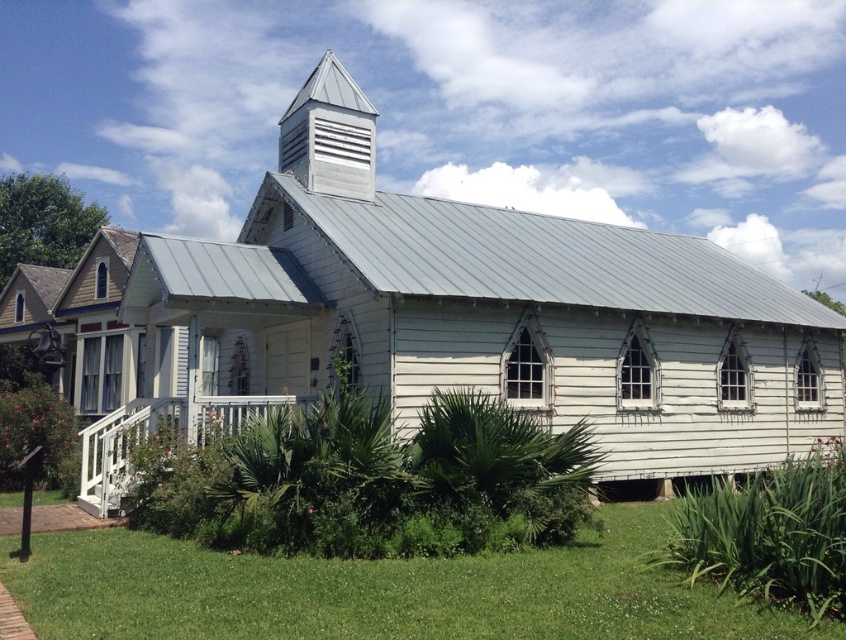
Measure the distance between point (x=146, y=540) and camera.

Point (x=146, y=540) and camera are 10.81 meters apart.

At what (x,y) coordinates should I click in order to perform the action: click on green grass at lower center. Please return your answer as a coordinate pair (x, y). Looking at the image, I should click on (377, 592).

Locate an element on the screen. This screenshot has height=640, width=846. green grass at lower center is located at coordinates [x=377, y=592].

Who is lower down, white wood church at center or metallic silver spire at upper center?

Positioned lower is white wood church at center.

Can you confirm if white wood church at center is positioned below metallic silver spire at upper center?

Correct, white wood church at center is located below metallic silver spire at upper center.

Is point (633, 300) behind point (349, 164)?

No, it is not.

At what (x,y) coordinates should I click in order to perform the action: click on white wood church at center. Please return your answer as a coordinate pair (x, y). The height and width of the screenshot is (640, 846). Looking at the image, I should click on [x=445, y=328].

Is white painted wood porch at lower left shorter than metallic silver spire at upper center?

Indeed, white painted wood porch at lower left has a lesser height compared to metallic silver spire at upper center.

Who is positioned more to the left, white painted wood porch at lower left or metallic silver spire at upper center?

metallic silver spire at upper center is more to the left.

Where is `white painted wood porch at lower left`? white painted wood porch at lower left is located at coordinates (157, 435).